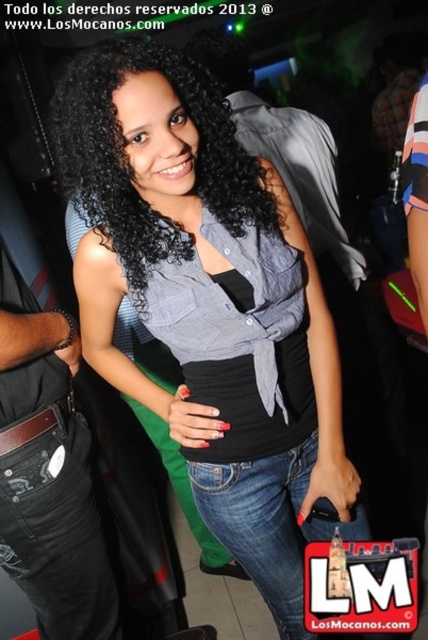
Question: Which of these objects is positioned closest to the black curly hair at center?

Choices:
 (A) gray matte shirt at center
 (B) denim shirt at center

Answer: (B)

Question: Which point appears closest to the camera in this image?

Choices:
 (A) (140, 308)
 (B) (326, 136)

Answer: (A)

Question: Is black curly hair at center further to camera compared to gray matte shirt at center?

Choices:
 (A) no
 (B) yes

Answer: (A)

Question: Is denim shirt at center above black curly hair at center?

Choices:
 (A) yes
 (B) no

Answer: (B)

Question: Estimate the real-world distances between objects in this image. Which object is farther from the denim shirt at center?

Choices:
 (A) gray matte shirt at center
 (B) black curly hair at center

Answer: (A)

Question: From the image, what is the correct spatial relationship of denim shirt at center in relation to gray matte shirt at center?

Choices:
 (A) right
 (B) left

Answer: (B)